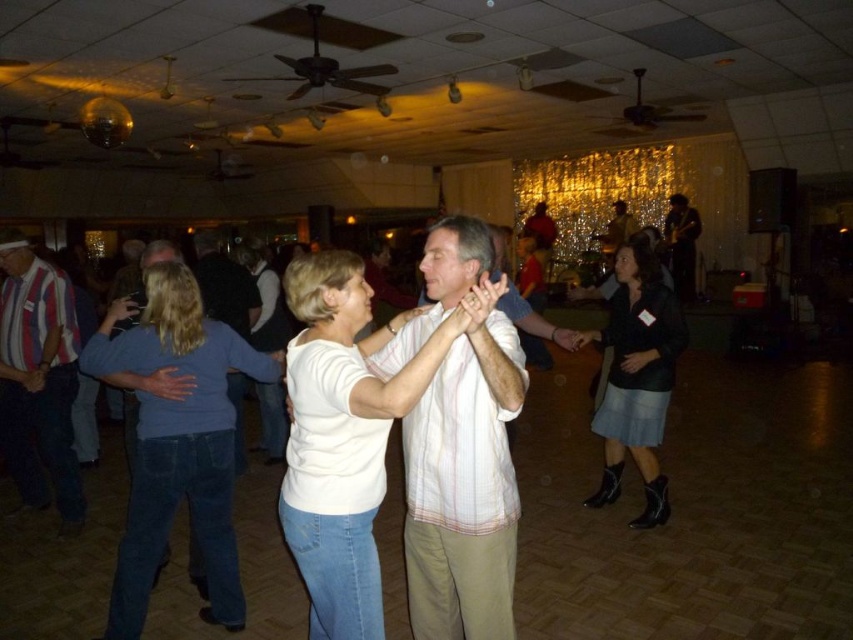
You are a photographer setting up a camera in the dance hall. You notice the white matte shirt at center and the dark brown leather jacket at upper right. Which object should you focus on if you want to capture the smaller one?

The white matte shirt at center is smaller than the dark brown leather jacket at upper right, so you should focus on the white matte shirt at center to capture the smaller one.

You are a photographer positioned at the entrance of the dance hall. You want to capture a photo that includes both the denim skirt at lower right and the white cotton shirt at center. Based on their positions, which object should you focus on first to ensure both are in frame?

The denim skirt at lower right is below the white cotton shirt at center, so you should focus on the white cotton shirt at center first to ensure both are in frame.

You are a photographer setting up a camera to capture the couple in the dance hall. The camera has a fixed width frame. If you want to ensure both the white matte shirt at center and the striped cotton shirt at left are fully visible, which shirt requires more space in the frame due to its width?

The white matte shirt at center requires more space in the frame because its width surpasses that of the striped cotton shirt at left.